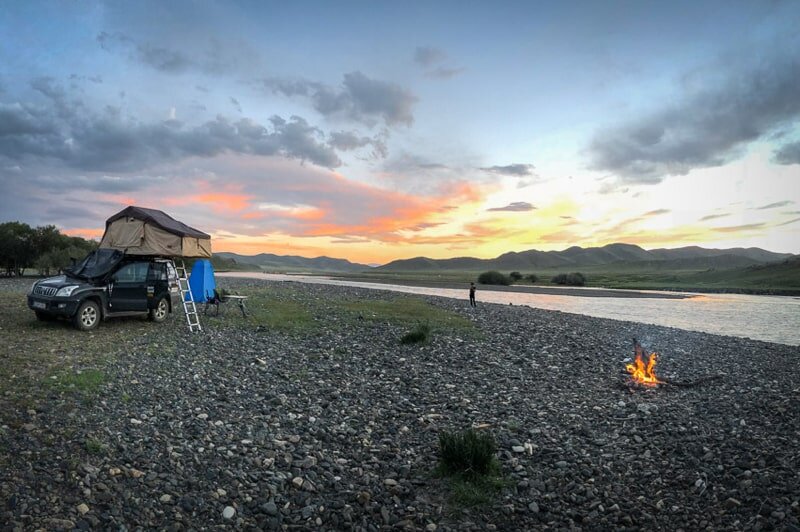
Image resolution: width=800 pixels, height=532 pixels. What are the coordinates of `window` in the screenshot? It's located at (134, 264).